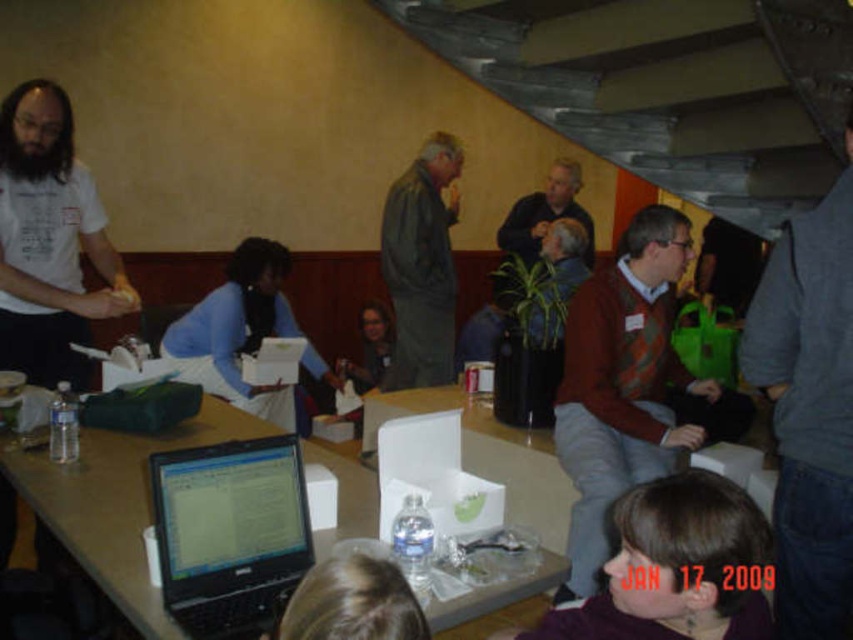
Question: Where is white matte shirt at left located in relation to blue matte shirt at center in the image?

Choices:
 (A) left
 (B) right

Answer: (A)

Question: Which is farther from the dark gray jacket at center?

Choices:
 (A) matte plastic table at center
 (B) blue matte shirt at center
 (C) knitted sweater at center

Answer: (A)

Question: Which object is closer to the camera taking this photo?

Choices:
 (A) black glossy laptop at lower left
 (B) blue matte shirt at center
 (C) matte plastic table at center

Answer: (A)

Question: Is black glossy laptop at lower left closer to camera compared to purple matte shirt at lower center?

Choices:
 (A) no
 (B) yes

Answer: (A)

Question: In this image, where is knitted sweater at center located relative to black glossy laptop at lower left?

Choices:
 (A) left
 (B) right

Answer: (B)

Question: Which point is closer to the camera taking this photo?

Choices:
 (A) (540, 588)
 (B) (45, 129)
 (C) (582, 481)
 (D) (753, 512)

Answer: (D)